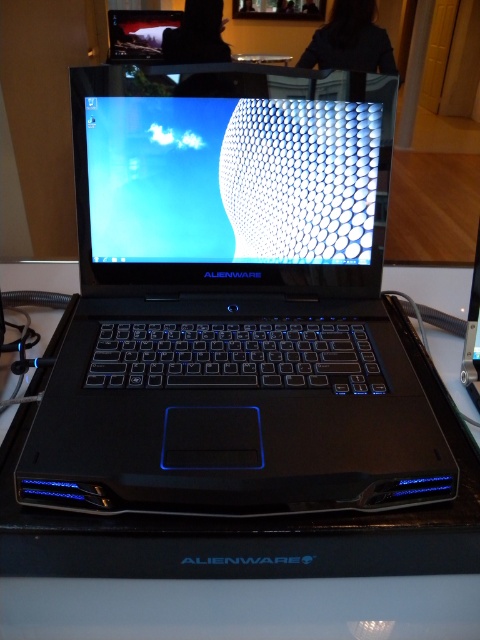
Does matte black screen at center have a smaller size compared to black plastic table at center?

Correct, matte black screen at center occupies less space than black plastic table at center.

Is point (224, 227) closer to viewer compared to point (324, 579)?

No, (224, 227) is further to viewer.

Is point (159, 148) less distant than point (11, 628)?

No, (159, 148) is further to viewer.

Locate an element on the screen. The height and width of the screenshot is (640, 480). matte black screen at center is located at coordinates (231, 179).

Identify the location of matte black laptop at center. (231, 304).

Does matte black laptop at center come behind black plastic table at center?

No, matte black laptop at center is closer to the viewer.

Who is more distant from viewer, (160,189) or (348,602)?

The point (160,189) is more distant.

I want to click on matte black laptop at center, so click(231, 304).

What do you see at coordinates (231, 304) in the screenshot?
I see `matte black laptop at center` at bounding box center [231, 304].

Does matte black laptop at center appear on the left side of matte black screen at center?

Indeed, matte black laptop at center is positioned on the left side of matte black screen at center.

Does point (338, 173) come behind point (330, 202)?

That is False.

This screenshot has height=640, width=480. Identify the location of matte black laptop at center. (231, 304).